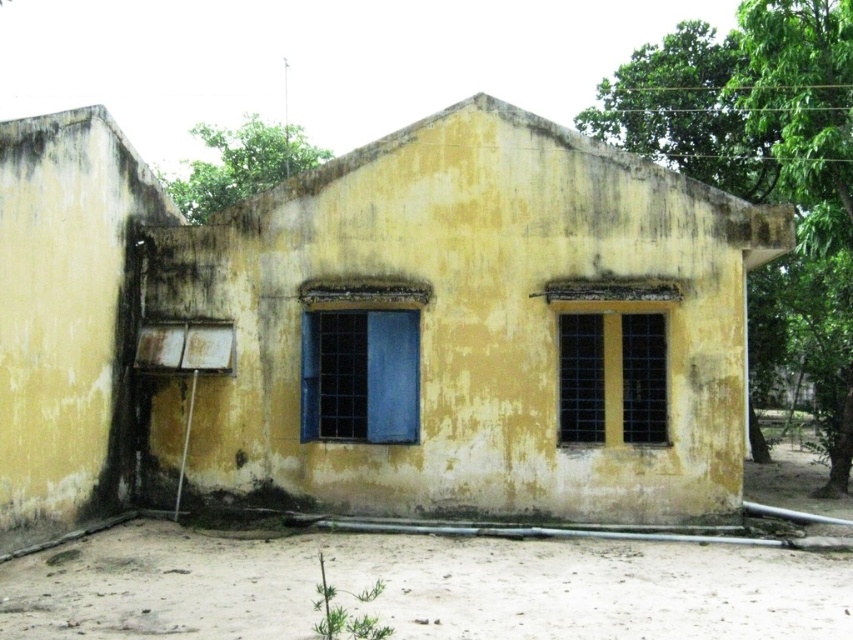
Is brown sandy dirt field at lower center further to camera compared to blue glass window at center?

No, it is in front of blue glass window at center.

Find the location of a particular element. This screenshot has height=640, width=853. brown sandy dirt field at lower center is located at coordinates (421, 588).

Between yellow matte building at center and brown sandy dirt field at lower center, which one appears on the right side from the viewer's perspective?

Positioned to the right is brown sandy dirt field at lower center.

The image size is (853, 640). Identify the location of yellow matte building at center. (375, 308).

The image size is (853, 640). Describe the element at coordinates (375, 308) in the screenshot. I see `yellow matte building at center` at that location.

Find the location of a particular element. The height and width of the screenshot is (640, 853). yellow matte building at center is located at coordinates (375, 308).

Locate an element on the screen. Image resolution: width=853 pixels, height=640 pixels. yellow matte building at center is located at coordinates (375, 308).

Is yellow matte building at center wider than blue glass window at center?

No, yellow matte building at center is not wider than blue glass window at center.

Which is in front, point (421, 180) or point (393, 326)?

Point (393, 326) is in front.

I want to click on yellow matte building at center, so click(375, 308).